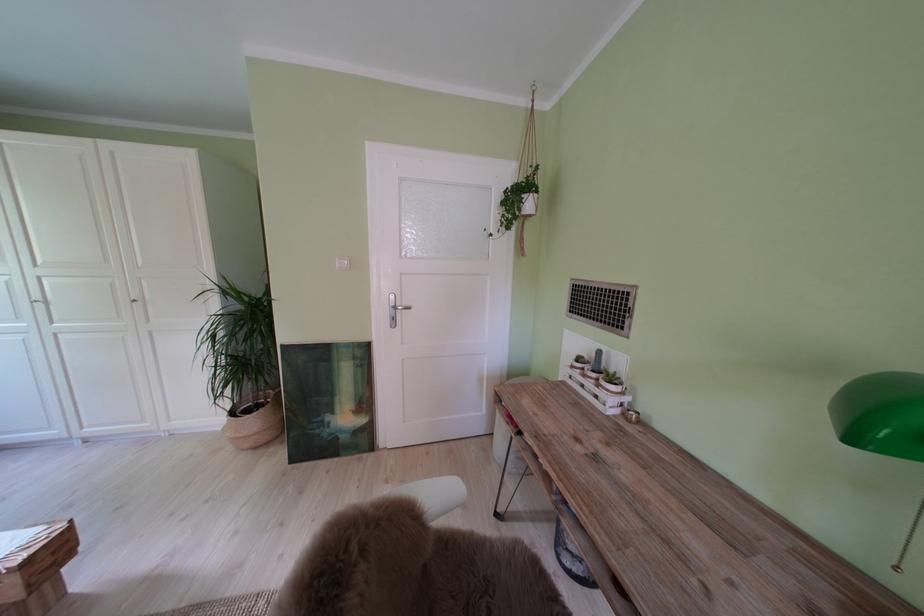
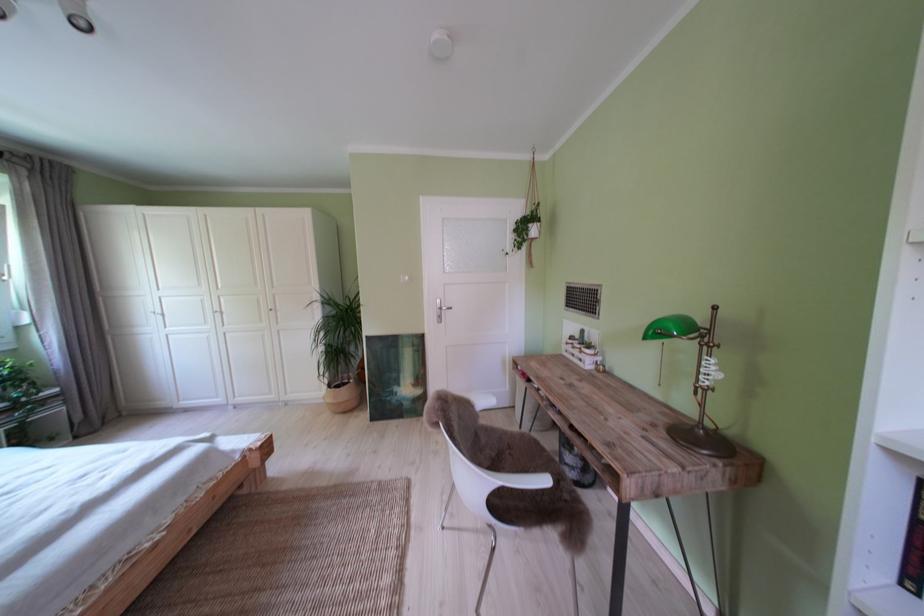
Where in the second image is the point corresponding to point (404, 302) from the first image?

(450, 307)